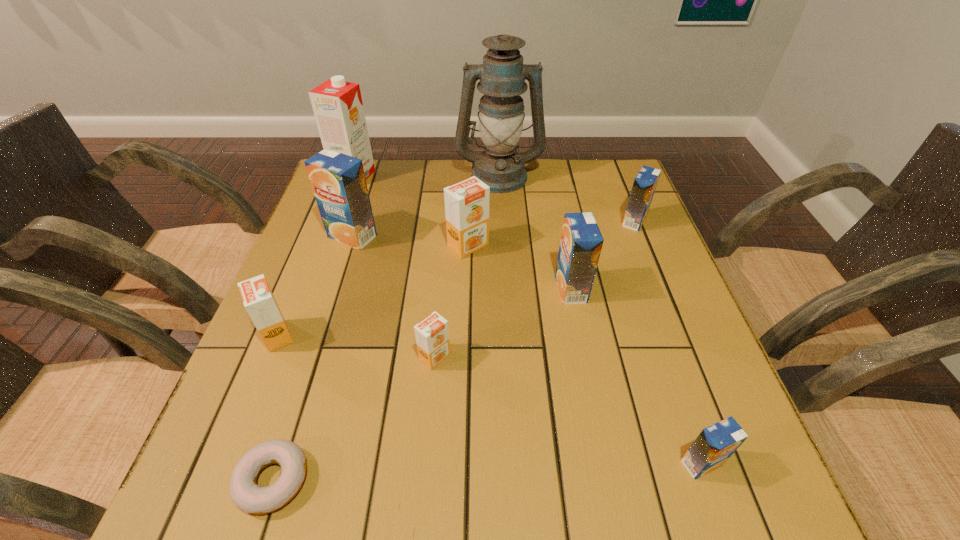
Where is `empty space between the second biggest orange orange juice and the carton`? This screenshot has height=540, width=960. empty space between the second biggest orange orange juice and the carton is located at coordinates (316, 256).

Point out which object is positioned as the nearest to the farthest orange orange juice. Please provide its 2D coordinates. Your answer should be formatted as a tuple, i.e. [(x, y)], where the tuple contains the x and y coordinates of a point satisfying the conditions above.

[(581, 242)]

Identify which object is the ninth nearest to the leftmost orange orange juice. Please provide its 2D coordinates. Your answer should be formatted as a tuple, i.e. [(x, y)], where the tuple contains the x and y coordinates of a point satisfying the conditions above.

[(645, 182)]

Find the location of a particular element. the fifth closest orange_juice to the carton is located at coordinates tap(581, 242).

Find the location of a particular element. orange_juice that stands as the second closest to the third orange_juice from right to left is located at coordinates pyautogui.click(x=645, y=182).

You are a GUI agent. You are given a task and a screenshot of the screen. Output one action in this format:
    pyautogui.click(x=<x>, y=<y>)
    Task: Click on the third closest blue orange_juice to the second smallest blue orange_juice
    This screenshot has height=540, width=960.
    Given the screenshot: What is the action you would take?
    [338, 181]

In order to click on blue orange_juice identified as the closest to the third biggest blue orange_juice in this screenshot , I will do `click(581, 242)`.

The height and width of the screenshot is (540, 960). I want to click on the third closest orange orange juice relative to the tallest object, so click(258, 299).

Identify which orange orange juice is the nearest to the second nearest blue orange_juice. Please provide its 2D coordinates. Your answer should be formatted as a tuple, i.e. [(x, y)], where the tuple contains the x and y coordinates of a point satisfying the conditions above.

[(467, 202)]

The width and height of the screenshot is (960, 540). I want to click on vacant space that satisfies the following two spatial constraints: 1. on the front side of the second smallest blue orange_juice; 2. on the left side of the carton, so tap(337, 221).